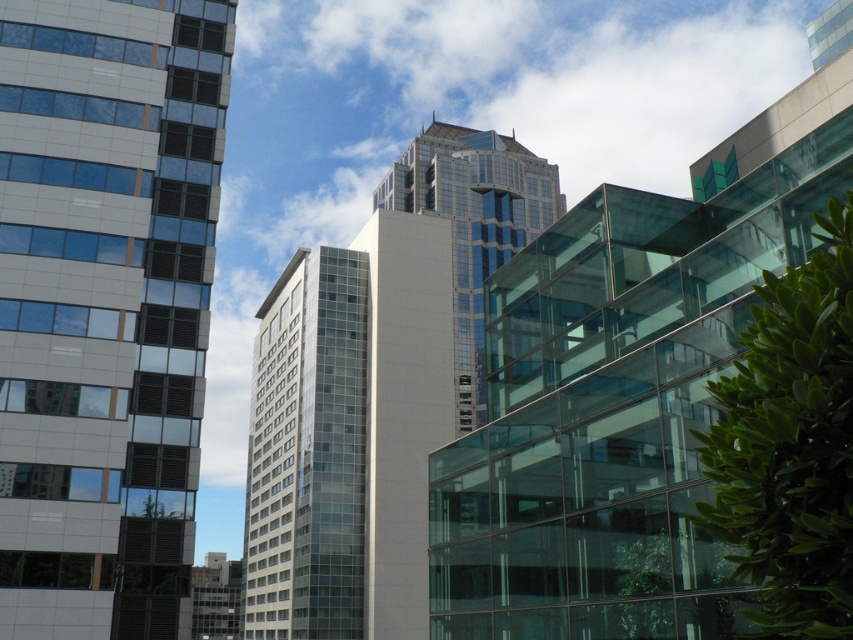
Question: Can you confirm if white glass building at center is positioned to the left of glassy reflective skyscraper at center?

Choices:
 (A) no
 (B) yes

Answer: (B)

Question: Which object is the farthest from the white glass building at left?

Choices:
 (A) glassy reflective skyscraper at center
 (B) white glass building at center

Answer: (A)

Question: Where is white glass building at left located in relation to white glass building at center in the image?

Choices:
 (A) below
 (B) above

Answer: (B)

Question: Which point is closer to the camera?

Choices:
 (A) white glass building at center
 (B) glassy reflective skyscraper at center

Answer: (B)

Question: Based on their relative distances, which object is farther from the glassy reflective skyscraper at center?

Choices:
 (A) white glass building at left
 (B) white glass building at center

Answer: (A)

Question: Does white glass building at left have a larger size compared to glassy reflective skyscraper at center?

Choices:
 (A) yes
 (B) no

Answer: (B)